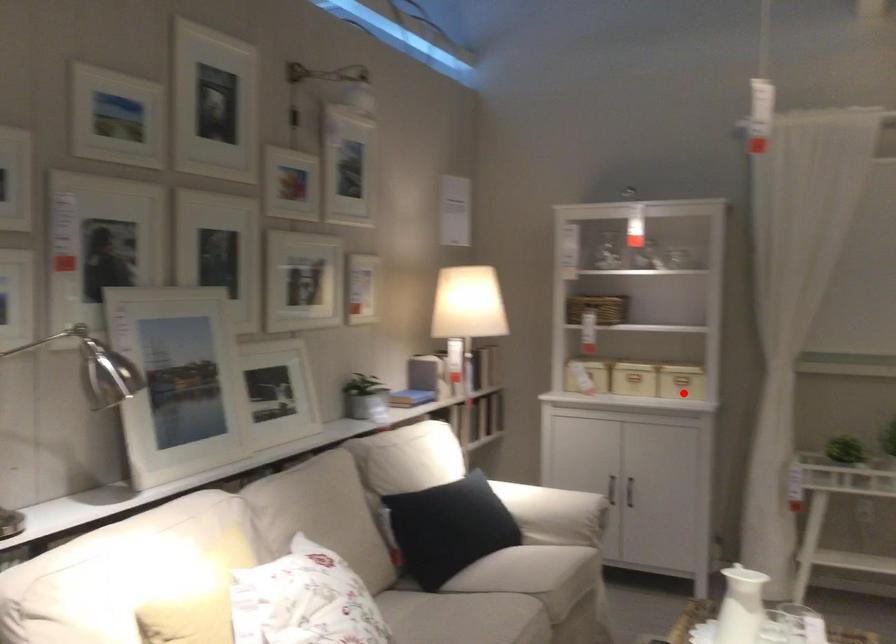
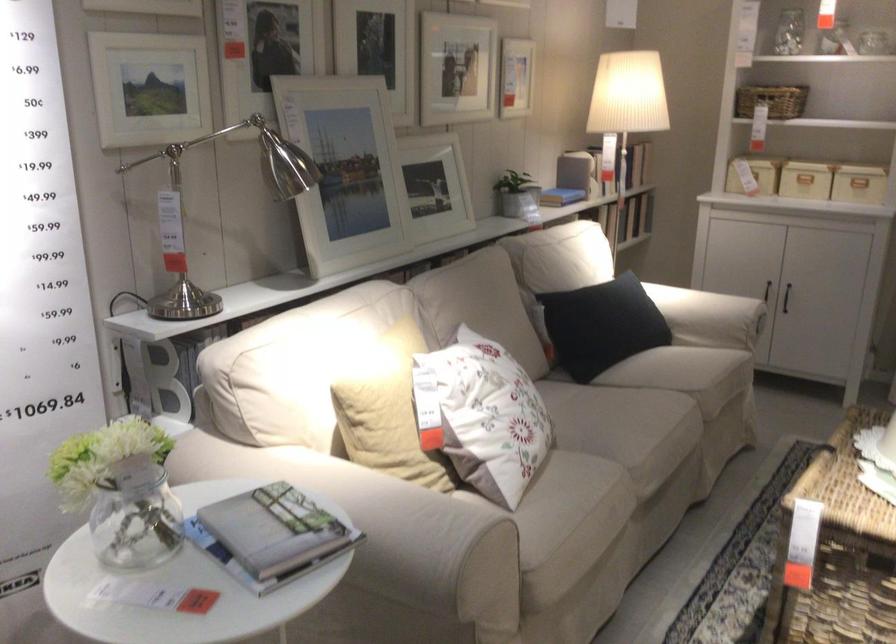
The point at the highlighted location is marked in the first image. Where is the corresponding point in the second image?

(858, 184)